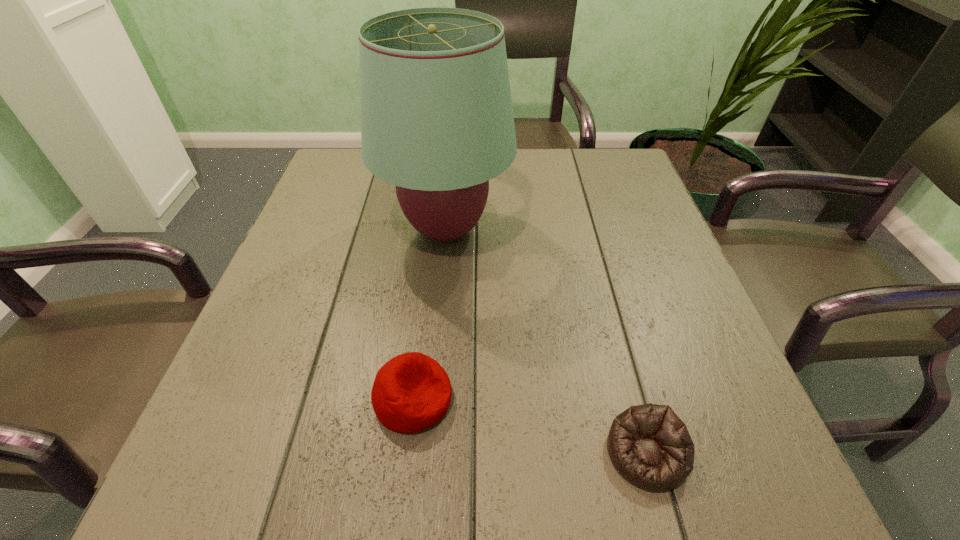
Image resolution: width=960 pixels, height=540 pixels. What are the coordinates of `free area in between the taller beanbag and the rightmost object` in the screenshot? It's located at click(530, 426).

At what (x,y) coordinates should I click in order to perform the action: click on free space that is in between the second shortest object and the tallest object. Please return your answer as a coordinate pair (x, y). Looking at the image, I should click on (429, 314).

The width and height of the screenshot is (960, 540). What are the coordinates of `vacant area that lies between the farthest object and the shortest object` in the screenshot? It's located at (546, 341).

Find the location of a particular element. The height and width of the screenshot is (540, 960). free point between the left beanbag and the farthest object is located at coordinates (429, 314).

This screenshot has height=540, width=960. In order to click on free point between the second shortest object and the shorter beanbag in this screenshot , I will do `click(530, 426)`.

The image size is (960, 540). Find the location of `vacant point located between the lampshade and the shortest object`. vacant point located between the lampshade and the shortest object is located at coordinates [x=546, y=341].

You are a GUI agent. You are given a task and a screenshot of the screen. Output one action in this format:
    pyautogui.click(x=<x>, y=<y>)
    Task: Click on the free space between the taller beanbag and the lampshade
    
    Given the screenshot: What is the action you would take?
    pyautogui.click(x=429, y=314)

At what (x,y) coordinates should I click in order to perform the action: click on empty space between the second shortest object and the shorter beanbag. Please return your answer as a coordinate pair (x, y). Image resolution: width=960 pixels, height=540 pixels. Looking at the image, I should click on (530, 426).

The width and height of the screenshot is (960, 540). What are the coordinates of `vacant space in between the tallest object and the rightmost object` in the screenshot? It's located at (546, 341).

Locate an element on the screen. object that is the closest one to the shortest object is located at coordinates (412, 392).